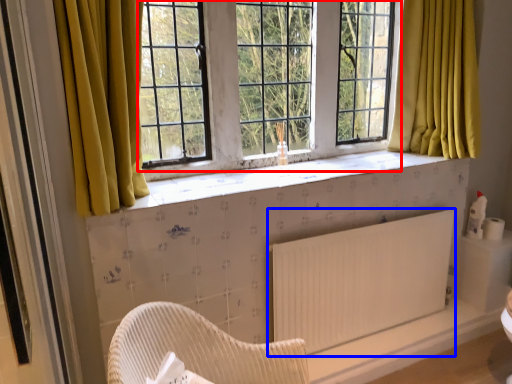
Question: Which object appears closest to the camera in this image, window screen (highlighted by a red box) or radiator (highlighted by a blue box)?

Choices:
 (A) window screen
 (B) radiator

Answer: (A)